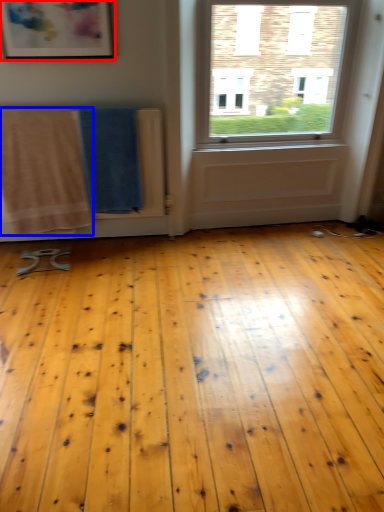
Question: Among these objects, which one is nearest to the camera, picture frame (highlighted by a red box) or beach towel (highlighted by a blue box)?

Choices:
 (A) picture frame
 (B) beach towel

Answer: (A)